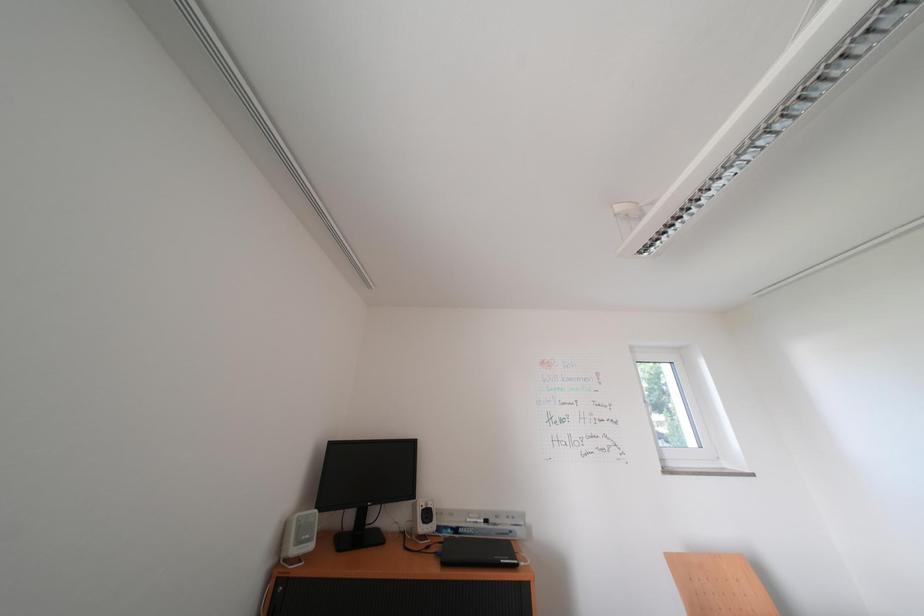
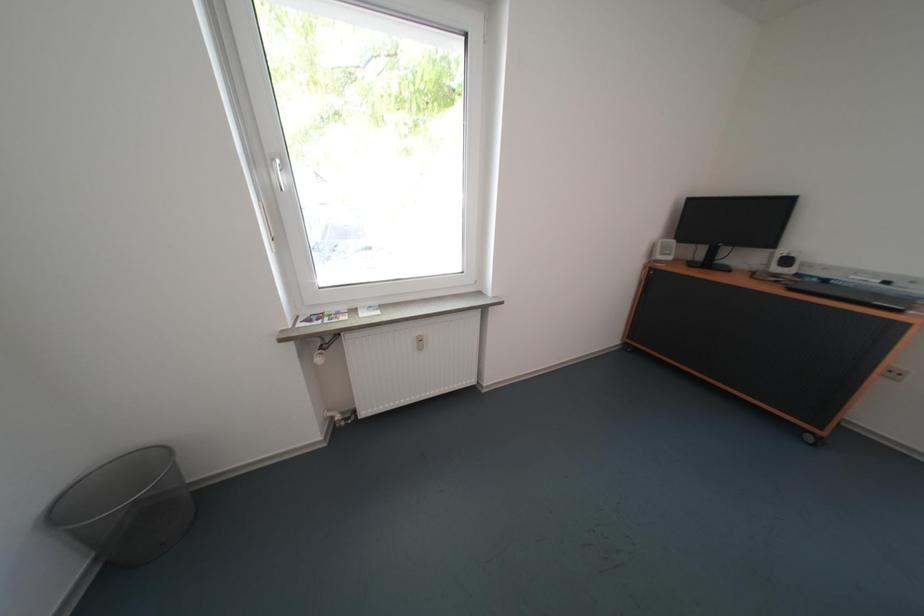
From the picture: Based on the continuous images, in which direction is the camera rotating?

The camera rotated toward left-down.